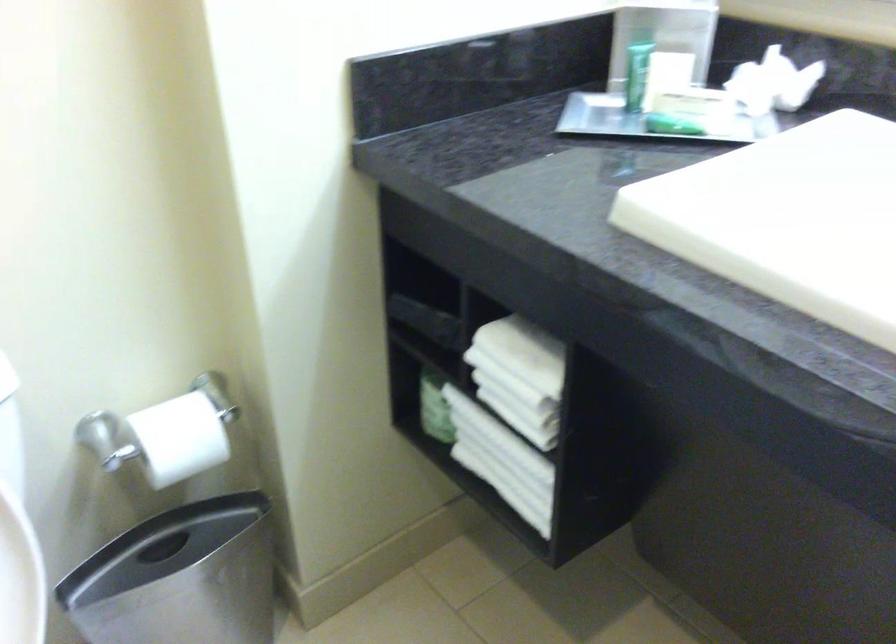
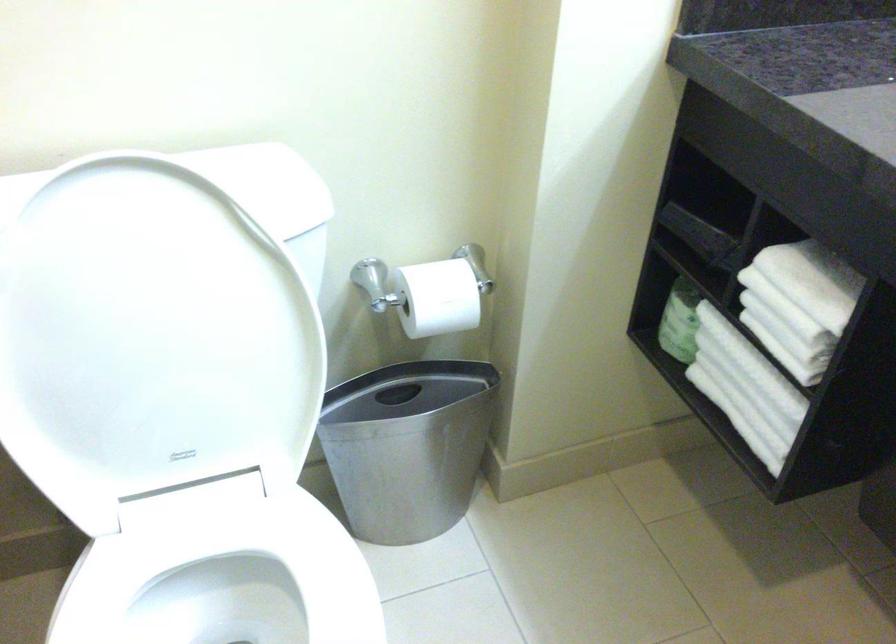
Locate, in the second image, the point that corresponds to (x=521, y=354) in the first image.

(806, 281)